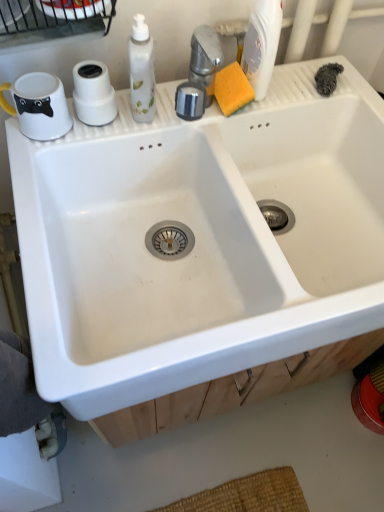
The height and width of the screenshot is (512, 384). Describe the element at coordinates (262, 45) in the screenshot. I see `white plastic bottle at upper right` at that location.

Measure the distance between white ceramic sink at center and camera.

They are 23.35 inches apart.

Where is `white plastic bottle at upper right`? Image resolution: width=384 pixels, height=512 pixels. white plastic bottle at upper right is located at coordinates (262, 45).

How different are the orientations of white plastic bottle at upper right and white matte toilet paper at upper left in degrees?

The angular difference between white plastic bottle at upper right and white matte toilet paper at upper left is 0.0314 degrees.

In the scene shown: Is white plastic bottle at upper right with white matte toilet paper at upper left?

No, white plastic bottle at upper right is not next to white matte toilet paper at upper left.

Could you tell me if white plastic bottle at upper right is facing white matte toilet paper at upper left?

No, white plastic bottle at upper right is not aimed at white matte toilet paper at upper left.

From the image's perspective, is white plastic bottle at upper right located above white matte toilet paper at upper left?

Yes.

Who is bigger, white matte toilet paper at upper left or wooden drawer at lower center?

wooden drawer at lower center is bigger.

Can you confirm if white matte toilet paper at upper left is positioned to the left of wooden drawer at lower center?

Indeed, white matte toilet paper at upper left is positioned on the left side of wooden drawer at lower center.

What's the angular difference between white matte toilet paper at upper left and wooden drawer at lower center's facing directions?

0.916 degrees.

Which of these two, white matte toilet paper at upper left or wooden drawer at lower center, is wider?

wooden drawer at lower center.

Which is closer, (299, 350) or (109, 109)?

Point (299, 350) appears to be farther away from the viewer than point (109, 109).

Can you confirm if white ceramic sink at center is shorter than white matte toilet paper at upper left?

In fact, white ceramic sink at center may be taller than white matte toilet paper at upper left.

Which object is positioned more to the left, white ceramic sink at center or white matte toilet paper at upper left?

Positioned to the left is white matte toilet paper at upper left.

Does white ceramic sink at center touch white matte toilet paper at upper left?

No, white ceramic sink at center is not next to white matte toilet paper at upper left.

From the image's perspective, is white ceramic sink at center located above or below wooden drawer at lower center?

white ceramic sink at center is above wooden drawer at lower center.

From the picture: Is white ceramic sink at center inside the boundaries of wooden drawer at lower center, or outside?

white ceramic sink at center is not inside wooden drawer at lower center, it's outside.

Is white ceramic sink at center closer to camera compared to wooden drawer at lower center?

Yes, the depth of white ceramic sink at center is less than that of wooden drawer at lower center.

Considering the sizes of objects white ceramic sink at center and wooden drawer at lower center in the image provided, who is thinner, white ceramic sink at center or wooden drawer at lower center?

wooden drawer at lower center.

Considering the positions of objects white ceramic sink at center and white plastic bottle at upper right in the image provided, who is more to the left, white ceramic sink at center or white plastic bottle at upper right?

white ceramic sink at center.

Does white ceramic sink at center have a greater height compared to white plastic bottle at upper right?

Yes.

Looking at their sizes, would you say white ceramic sink at center is wider or thinner than white plastic bottle at upper right?

white ceramic sink at center is wider than white plastic bottle at upper right.

Does white ceramic sink at center lie behind white plastic bottle at upper right?

No, it is in front of white plastic bottle at upper right.

Is white plastic bottle at upper right at the right side of white ceramic sink at center?

Yes, white plastic bottle at upper right is to the right of white ceramic sink at center.

Considering the relative sizes of white plastic bottle at upper right and white ceramic sink at center in the image provided, is white plastic bottle at upper right bigger than white ceramic sink at center?

Actually, white plastic bottle at upper right might be smaller than white ceramic sink at center.

Looking at this image, considering the relative sizes of white plastic bottle at upper right and white ceramic sink at center in the image provided, is white plastic bottle at upper right shorter than white ceramic sink at center?

Yes.

Is wooden drawer at lower center closer to camera compared to white ceramic sink at center?

No, it is behind white ceramic sink at center.

Which of these two, wooden drawer at lower center or white ceramic sink at center, is thinner?

Thinner between the two is wooden drawer at lower center.

Consider the image. Who is shorter, wooden drawer at lower center or white ceramic sink at center?

wooden drawer at lower center.

The height and width of the screenshot is (512, 384). In the image, there is a white plastic bottle at upper right. In order to click on toilet paper below it (from a real-world perspective) in this screenshot , I will do `click(93, 93)`.

The height and width of the screenshot is (512, 384). In order to click on toilet paper in front of the wooden drawer at lower center in this screenshot , I will do `click(93, 93)`.

Considering their positions, is white plastic bottle at upper right positioned closer to white matte toilet paper at upper left than wooden drawer at lower center?

white plastic bottle at upper right.

Considering their positions, is wooden drawer at lower center positioned further to white plastic bottle at upper right than white matte toilet paper at upper left?

wooden drawer at lower center is positioned further to the anchor white plastic bottle at upper right.

Based on their spatial positions, is white matte toilet paper at upper left or white plastic bottle at upper right further from wooden drawer at lower center?

The object further to wooden drawer at lower center is white matte toilet paper at upper left.

From the image, which object appears to be farther from white ceramic sink at center, white plastic bottle at upper right or white matte toilet paper at upper left?

white plastic bottle at upper right lies further to white ceramic sink at center than the other object.

Considering their positions, is white matte toilet paper at upper left positioned closer to white ceramic sink at center than wooden drawer at lower center?

Based on the image, wooden drawer at lower center appears to be nearer to white ceramic sink at center.

When comparing their distances from white matte toilet paper at upper left, does white ceramic sink at center or white plastic bottle at upper right seem closer?

white plastic bottle at upper right is closer to white matte toilet paper at upper left.

Looking at the image, which one is located further to white matte toilet paper at upper left, white plastic bottle at upper right or white ceramic sink at center?

white ceramic sink at center lies further to white matte toilet paper at upper left than the other object.

Estimate the real-world distances between objects in this image. Which object is further from white ceramic sink at center, wooden drawer at lower center or white matte toilet paper at upper left?

white matte toilet paper at upper left is positioned further to the anchor white ceramic sink at center.

This screenshot has height=512, width=384. What are the coordinates of `sink that lies between white plastic bottle at upper right and wooden drawer at lower center from top to bottom` in the screenshot? It's located at (200, 240).

This screenshot has width=384, height=512. What are the coordinates of `toilet paper between white plastic bottle at upper right and wooden drawer at lower center in the vertical direction` in the screenshot? It's located at (93, 93).

This screenshot has width=384, height=512. I want to click on sink between white matte toilet paper at upper left and wooden drawer at lower center from top to bottom, so click(x=200, y=240).

You are a GUI agent. You are given a task and a screenshot of the screen. Output one action in this format:
    pyautogui.click(x=<x>, y=<y>)
    Task: Click on the sink between white matte toilet paper at upper left and white plastic bottle at upper right in the horizontal direction
    Image resolution: width=384 pixels, height=512 pixels.
    Given the screenshot: What is the action you would take?
    tap(200, 240)